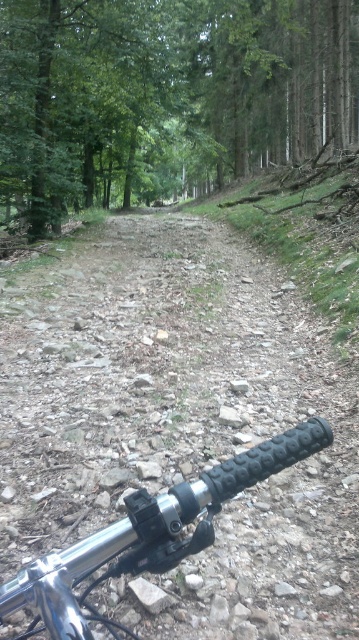
Can you confirm if green matte tree at center is positioned to the right of black rubber handlebar at lower right?

No, green matte tree at center is not to the right of black rubber handlebar at lower right.

Does green matte tree at center have a lesser height compared to black rubber handlebar at lower right?

No, green matte tree at center is not shorter than black rubber handlebar at lower right.

Which is in front, point (230, 77) or point (73, 604)?

Point (73, 604)

Where is `green matte tree at center`? The image size is (359, 640). green matte tree at center is located at coordinates (165, 97).

Who is positioned more to the right, dusty gravel path at center or black rubber handlebar at lower right?

Positioned to the right is black rubber handlebar at lower right.

Does dusty gravel path at center come in front of black rubber handlebar at lower right?

No, it is behind black rubber handlebar at lower right.

Where is `dusty gravel path at center`? This screenshot has width=359, height=640. dusty gravel path at center is located at coordinates click(x=179, y=424).

Which is more to the right, dusty gravel path at center or green matte tree at center?

green matte tree at center

Does dusty gravel path at center have a lesser width compared to green matte tree at center?

Correct, dusty gravel path at center's width is less than green matte tree at center's.

Where is `dusty gravel path at center`? This screenshot has width=359, height=640. dusty gravel path at center is located at coordinates (179, 424).

This screenshot has height=640, width=359. What are the coordinates of `dusty gravel path at center` in the screenshot? It's located at (179, 424).